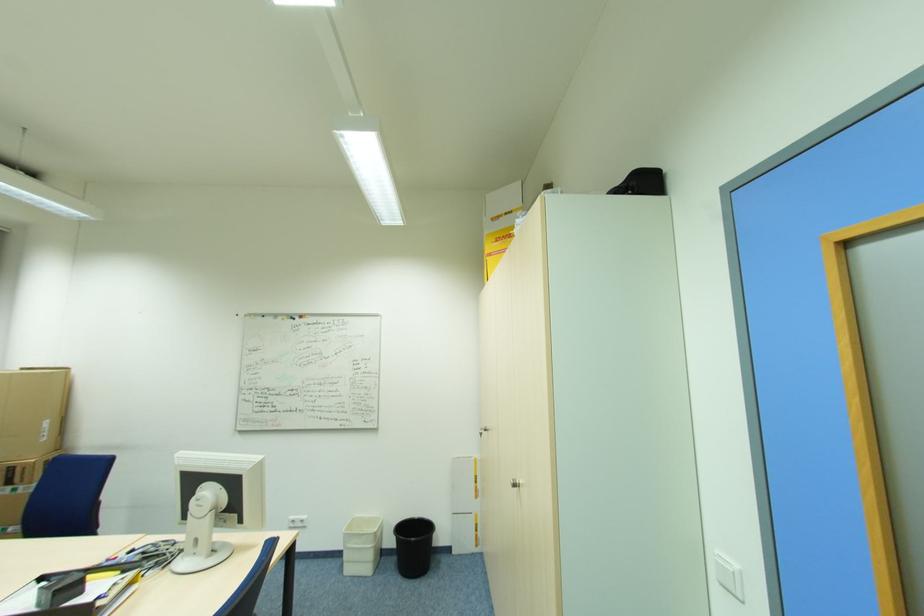
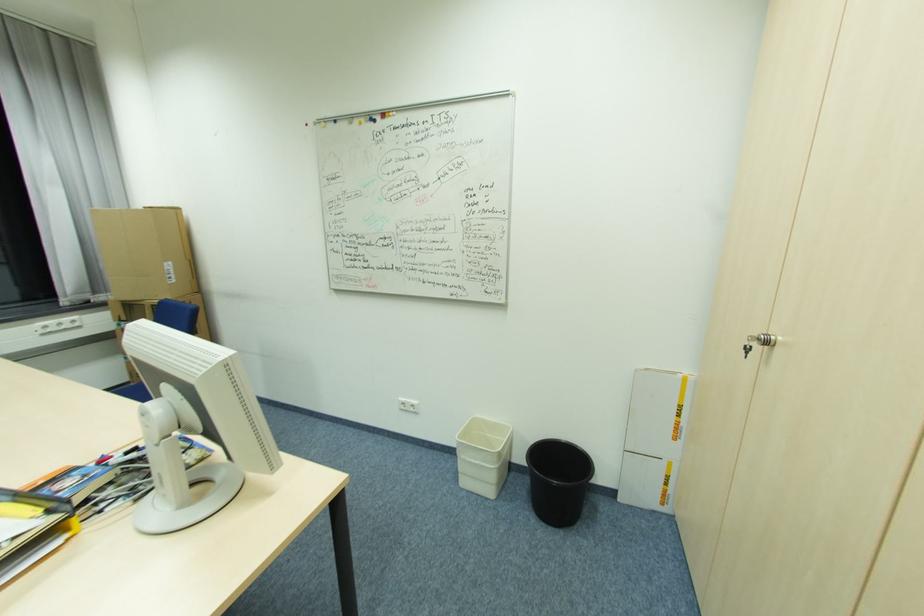
The point at (346, 565) is marked in the first image. Where is the corresponding point in the second image?

(463, 475)